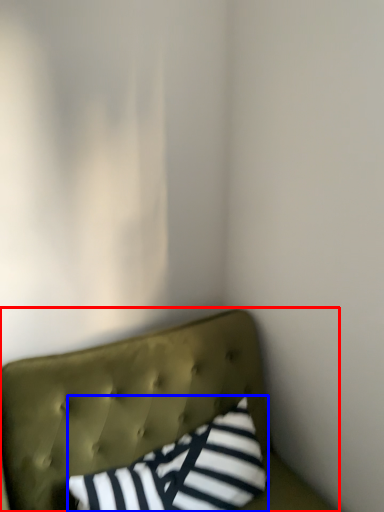
Question: Among these objects, which one is farthest to the camera, furniture (highlighted by a red box) or pillow (highlighted by a blue box)?

Choices:
 (A) furniture
 (B) pillow

Answer: (B)